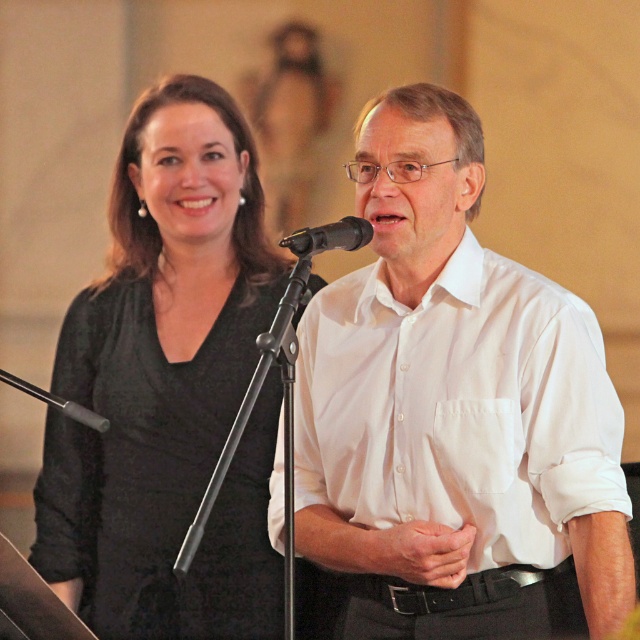
Does white matte shirt at center have a larger size compared to black matte dress at left?

Actually, white matte shirt at center might be smaller than black matte dress at left.

Is white matte shirt at center above black matte dress at left?

Incorrect, white matte shirt at center is not positioned above black matte dress at left.

The width and height of the screenshot is (640, 640). What are the coordinates of `white matte shirt at center` in the screenshot? It's located at (454, 412).

Locate an element on the screen. white matte shirt at center is located at coordinates 454,412.

This screenshot has height=640, width=640. What do you see at coordinates (454, 412) in the screenshot?
I see `white matte shirt at center` at bounding box center [454, 412].

At what (x,y) coordinates should I click in order to perform the action: click on white matte shirt at center. Please return your answer as a coordinate pair (x, y). Looking at the image, I should click on (454, 412).

Identify the location of white matte shirt at center. The image size is (640, 640). (454, 412).

Where is `white matte shirt at center`? The width and height of the screenshot is (640, 640). white matte shirt at center is located at coordinates (454, 412).

Based on the photo, how distant is black matte dress at left from black matte microphone at center?

black matte dress at left and black matte microphone at center are 34.17 inches apart.

Does black matte dress at left appear on the right side of black matte microphone at center?

No, black matte dress at left is not to the right of black matte microphone at center.

Does point (237, 582) lie behind point (304, 237)?

Yes, point (237, 582) is farther from viewer.

The width and height of the screenshot is (640, 640). I want to click on black matte dress at left, so click(x=168, y=387).